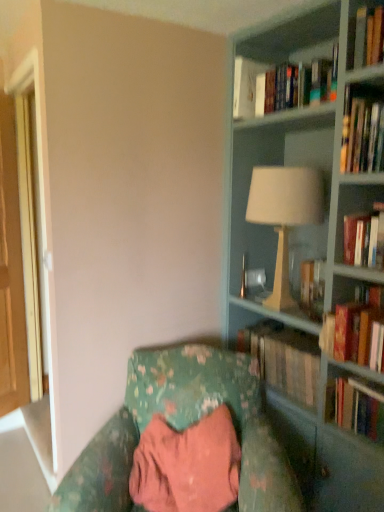
Question: Considering the relative positions of hardcover book at right, which appears as the first book when ordered from the bottom, and hardcover book at center, marked as the 4th book in a top-to-bottom arrangement, in the image provided, is hardcover book at right, which appears as the first book when ordered from the bottom, to the right of hardcover book at center, marked as the 4th book in a top-to-bottom arrangement, from the viewer's perspective?

Choices:
 (A) no
 (B) yes

Answer: (B)

Question: Is hardcover book at center, the second book positioned from the bottom, at the back of hardcover book at right, which appears as the first book when ordered from the bottom?

Choices:
 (A) yes
 (B) no

Answer: (B)

Question: From the image's perspective, is hardcover book at right, which appears as the first book when ordered from the bottom, located above hardcover book at center, marked as the 4th book in a top-to-bottom arrangement?

Choices:
 (A) yes
 (B) no

Answer: (B)

Question: Considering the relative sizes of hardcover book at right, which appears as the first book when ordered from the bottom, and hardcover book at center, the second book positioned from the bottom, in the image provided, is hardcover book at right, which appears as the first book when ordered from the bottom, bigger than hardcover book at center, the second book positioned from the bottom,?

Choices:
 (A) no
 (B) yes

Answer: (A)

Question: Does hardcover book at right, which appears as the first book when ordered from the bottom, turn towards hardcover book at center, marked as the 4th book in a top-to-bottom arrangement?

Choices:
 (A) no
 (B) yes

Answer: (A)

Question: Is hardcover book at center, the second book positioned from the bottom, completely or partially inside hardcover book at right, which appears as the first book when ordered from the bottom?

Choices:
 (A) no
 (B) yes

Answer: (A)

Question: Is matte gray bookcase at right closer to camera compared to floral fabric chair at lower center?

Choices:
 (A) yes
 (B) no

Answer: (B)

Question: Is matte gray bookcase at right located outside floral fabric chair at lower center?

Choices:
 (A) no
 (B) yes

Answer: (B)

Question: From a real-world perspective, is matte gray bookcase at right positioned over floral fabric chair at lower center based on gravity?

Choices:
 (A) yes
 (B) no

Answer: (A)

Question: Is matte gray bookcase at right thinner than floral fabric chair at lower center?

Choices:
 (A) yes
 (B) no

Answer: (A)

Question: From the image's perspective, is matte gray bookcase at right on floral fabric chair at lower center?

Choices:
 (A) yes
 (B) no

Answer: (A)

Question: Is the position of matte gray bookcase at right more distant than that of floral fabric chair at lower center?

Choices:
 (A) no
 (B) yes

Answer: (B)

Question: From a real-world perspective, is matte gray bookcase at right physically below hardcover book at right, which is the third book from top to bottom?

Choices:
 (A) yes
 (B) no

Answer: (B)